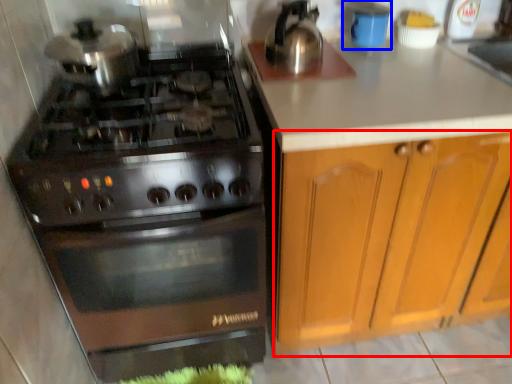
Question: Which point is closer to the camera, cabinetry (highlighted by a red box) or appliance (highlighted by a blue box)?

Choices:
 (A) cabinetry
 (B) appliance

Answer: (A)